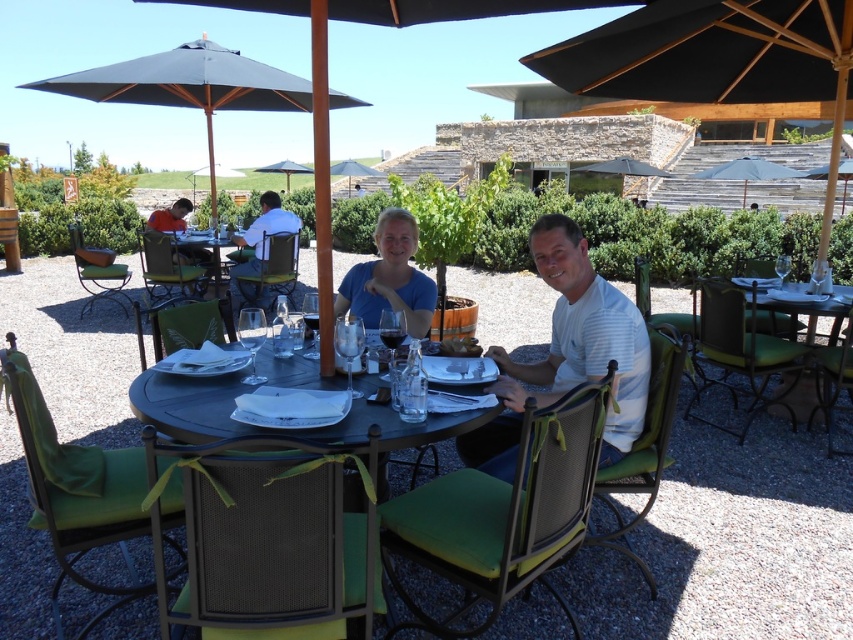
Question: Estimate the real-world distances between objects in this image. Which object is closer to the metallic silver table at center?

Choices:
 (A) matte black umbrella at center
 (B) matte blue shirt at center

Answer: (B)

Question: Does metallic silver table at center appear on the right side of black fabric umbrella at center?

Choices:
 (A) no
 (B) yes

Answer: (A)

Question: Among these objects, which one is nearest to the camera?

Choices:
 (A) teal fabric umbrella at upper center
 (B) black fabric umbrella at center
 (C) white shirt at center
 (D) matte blue shirt at center

Answer: (D)

Question: Does black fabric umbrella at upper center appear over matte black umbrella at center?

Choices:
 (A) no
 (B) yes

Answer: (A)

Question: Can you confirm if metallic silver table at center is thinner than black fabric umbrella at center?

Choices:
 (A) no
 (B) yes

Answer: (B)

Question: Among these points, which one is farthest from the camera?

Choices:
 (A) (337, 296)
 (B) (842, 209)
 (C) (199, 250)
 (D) (252, 266)

Answer: (B)